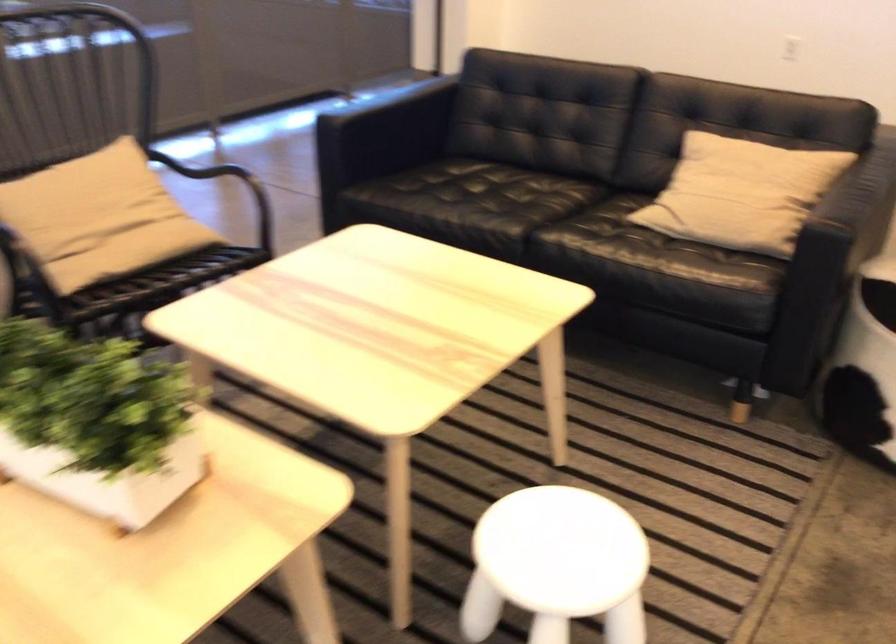
Describe the element at coordinates (9, 288) in the screenshot. Image resolution: width=896 pixels, height=644 pixels. I see `the chair armrest` at that location.